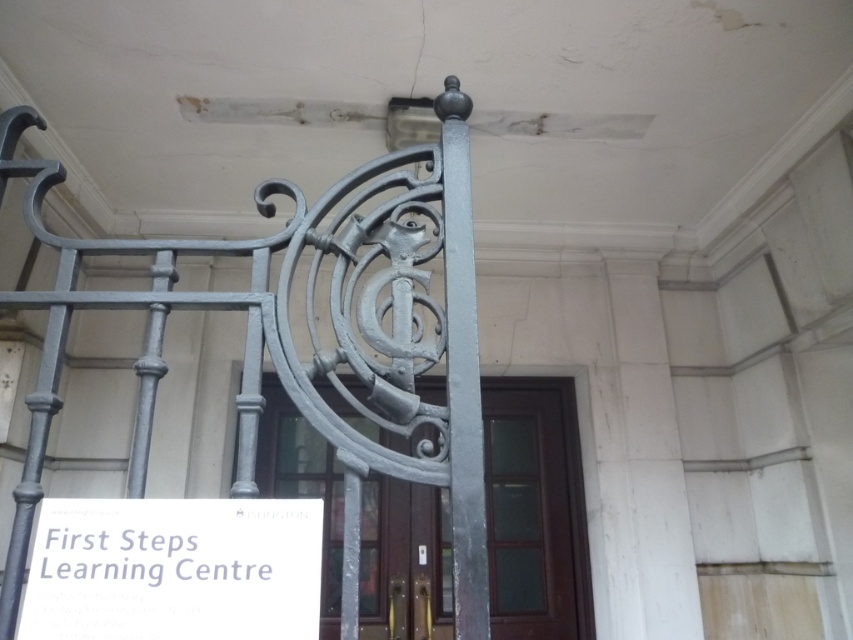
Question: Is matte gray metal gate at center further to the viewer compared to polished wood door at center?

Choices:
 (A) no
 (B) yes

Answer: (A)

Question: Which point appears farthest from the camera in this image?

Choices:
 (A) (474, 506)
 (B) (532, 465)
 (C) (321, 400)
 (D) (103, 579)

Answer: (B)

Question: Which is nearer to the white paper sign at lower left?

Choices:
 (A) polished wood door at center
 (B) matte gray metal gate at center

Answer: (B)

Question: Observing the image, what is the correct spatial positioning of white paper sign at lower left in reference to gray metal pole at center?

Choices:
 (A) right
 (B) left

Answer: (B)

Question: Estimate the real-world distances between objects in this image. Which object is closer to the white paper sign at lower left?

Choices:
 (A) polished wood door at center
 (B) gray metal pole at center

Answer: (B)

Question: Can you confirm if matte gray metal gate at center is positioned to the right of polished wood door at center?

Choices:
 (A) yes
 (B) no

Answer: (B)